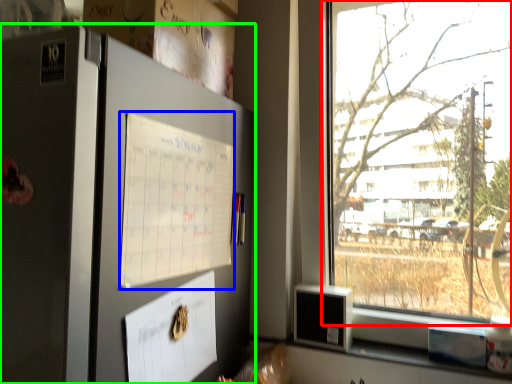
Question: Considering the real-world distances, which object is closest to window (highlighted by a red box)? poster (highlighted by a blue box) or fridge (highlighted by a green box).

Choices:
 (A) poster
 (B) fridge

Answer: (A)